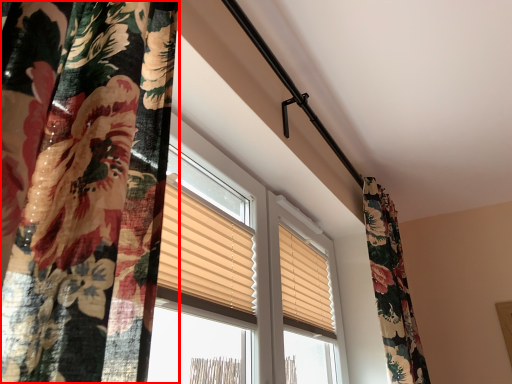
Question: Observing the image, what is the correct spatial positioning of curtain (annotated by the red box) in reference to window blind?

Choices:
 (A) left
 (B) right

Answer: (A)